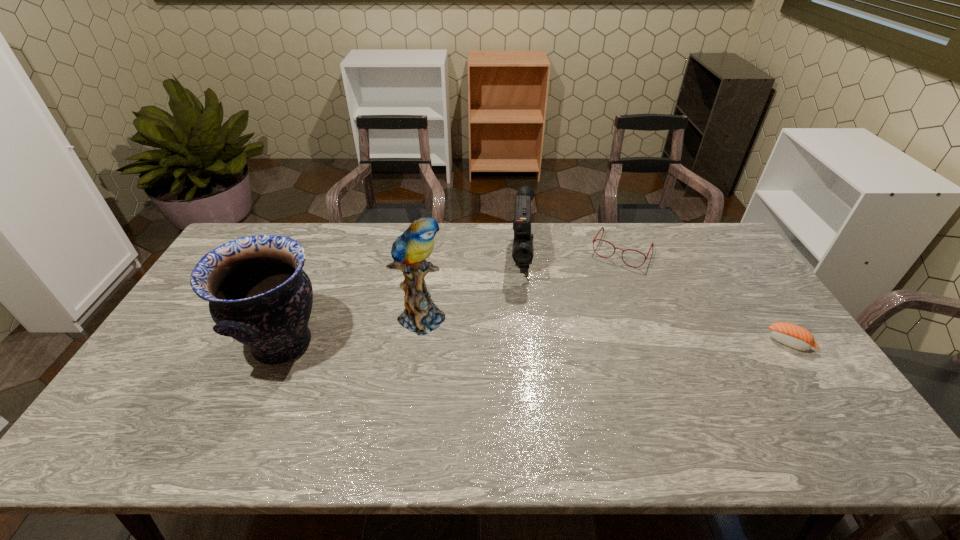
You are a GUI agent. You are given a task and a screenshot of the screen. Output one action in this format:
    pyautogui.click(x=<x>, y=<y>)
    Task: Click on the pottery
    The width and height of the screenshot is (960, 540).
    Given the screenshot: What is the action you would take?
    pyautogui.click(x=258, y=293)

At what (x,y) coordinates should I click in order to perform the action: click on the leftmost object. Please return your answer as a coordinate pair (x, y). Looking at the image, I should click on (258, 293).

Identify the location of sushi. (794, 336).

Image resolution: width=960 pixels, height=540 pixels. Identify the location of the shortest object. (794, 336).

The image size is (960, 540). I want to click on parrot, so click(x=409, y=251).

This screenshot has height=540, width=960. Identify the location of the tallest object. (409, 251).

At what (x,y) coordinates should I click in order to perform the action: click on the fourth tallest object. Please return your answer as a coordinate pair (x, y). Looking at the image, I should click on (594, 239).

This screenshot has height=540, width=960. I want to click on spectacles, so click(x=594, y=239).

You are a GUI agent. You are given a task and a screenshot of the screen. Output one action in this format:
    pyautogui.click(x=<x>, y=<y>)
    Task: Click on the camcorder
    This screenshot has width=960, height=540.
    Given the screenshot: What is the action you would take?
    pyautogui.click(x=522, y=251)

Identify the location of the third tallest object. pyautogui.click(x=522, y=251).